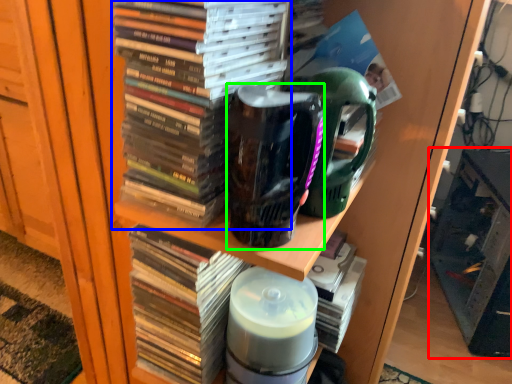
Question: Based on their relative distances, which object is farther from shelf (highlighted by a red box)? Choose from book (highlighted by a blue box) and mug (highlighted by a green box).

Choices:
 (A) book
 (B) mug

Answer: (A)